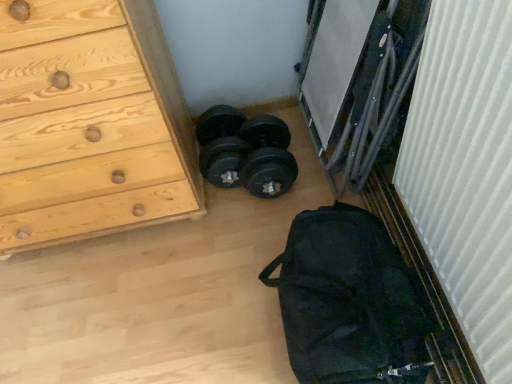
Measure the distance between natural wood chest of drawers at left and camera.

The distance of natural wood chest of drawers at left from camera is 33.01 inches.

The width and height of the screenshot is (512, 384). Identify the location of natural wood chest of drawers at left. (90, 124).

Image resolution: width=512 pixels, height=384 pixels. Identify the location of black fabric bag at lower right. (349, 301).

Measure the distance from black fabric bag at lower right to natural wood chest of drawers at left.

A distance of 25.01 inches exists between black fabric bag at lower right and natural wood chest of drawers at left.

Is black fabric bag at lower right far from natural wood chest of drawers at left?

No, black fabric bag at lower right is in close proximity to natural wood chest of drawers at left.

From a real-world perspective, is black fabric bag at lower right physically located above or below natural wood chest of drawers at left?

black fabric bag at lower right is situated lower than natural wood chest of drawers at left in the real world.

Which of these two, black fabric bag at lower right or natural wood chest of drawers at left, stands shorter?

Standing shorter between the two is black fabric bag at lower right.

Measure the distance from black rubber dumbbells at center to white ribbed curtain at right.

A distance of 26.06 inches exists between black rubber dumbbells at center and white ribbed curtain at right.

How different are the orientations of black rubber dumbbells at center and white ribbed curtain at right in degrees?

87.4 degrees separate the facing orientations of black rubber dumbbells at center and white ribbed curtain at right.

Is black rubber dumbbells at center taller or shorter than white ribbed curtain at right?

Clearly, black rubber dumbbells at center is shorter compared to white ribbed curtain at right.

You are a GUI agent. You are given a task and a screenshot of the screen. Output one action in this format:
    pyautogui.click(x=<x>, y=<y>)
    Task: Click on the curtain that appears on the right of black rubber dumbbells at center
    The image size is (512, 384).
    Given the screenshot: What is the action you would take?
    pyautogui.click(x=465, y=170)

From the image's perspective, relative to white ribbed curtain at right, is black fabric bag at lower right above or below?

Based on their image positions, black fabric bag at lower right is located beneath white ribbed curtain at right.

Which object is closer to the camera taking this photo, black fabric bag at lower right or white ribbed curtain at right?

white ribbed curtain at right is closer to the camera.

Is black fabric bag at lower right aimed at white ribbed curtain at right?

No.

Based on the photo, from a real-world perspective, is black fabric bag at lower right physically located above or below white ribbed curtain at right?

black fabric bag at lower right is below white ribbed curtain at right.

Is black fabric bag at lower right inside natural wood chest of drawers at left?

No, black fabric bag at lower right is not inside natural wood chest of drawers at left.

Based on the photo, is natural wood chest of drawers at left to the left or to the right of black fabric bag at lower right in the image?

Clearly, natural wood chest of drawers at left is on the left of black fabric bag at lower right in the image.

From the image's perspective, is natural wood chest of drawers at left positioned above or below black fabric bag at lower right?

Clearly, from the image's perspective, natural wood chest of drawers at left is above black fabric bag at lower right.

Is white ribbed curtain at right positioned with its back to black rubber dumbbells at center?

No, white ribbed curtain at right is not facing the opposite direction of black rubber dumbbells at center.

Is point (426, 243) farther from camera compared to point (199, 123)?

That is False.

Does white ribbed curtain at right appear on the right side of black rubber dumbbells at center?

Indeed, white ribbed curtain at right is positioned on the right side of black rubber dumbbells at center.

Which is in front, white ribbed curtain at right or black rubber dumbbells at center?

white ribbed curtain at right is in front.

Does white ribbed curtain at right have a greater height compared to black fabric bag at lower right?

Yes.

Is white ribbed curtain at right placed right next to black fabric bag at lower right?

No, white ribbed curtain at right is not touching black fabric bag at lower right.

From a real-world perspective, which is physically below, natural wood chest of drawers at left or white ribbed curtain at right?

In real-world perspective, natural wood chest of drawers at left is lower.

From the image's perspective, is natural wood chest of drawers at left over white ribbed curtain at right?

Correct, natural wood chest of drawers at left appears higher than white ribbed curtain at right in the image.

Is natural wood chest of drawers at left far from white ribbed curtain at right?

No, there isn't a large distance between natural wood chest of drawers at left and white ribbed curtain at right.

What's the angular difference between natural wood chest of drawers at left and white ribbed curtain at right's facing directions?

They differ by 90 degrees in their facing directions.

I want to click on chest of drawers located on the left of black fabric bag at lower right, so 90,124.

I want to click on reel that appears above the white ribbed curtain at right (from the image's perspective), so click(246, 151).

Which object lies further to the anchor point white ribbed curtain at right, black fabric bag at lower right or natural wood chest of drawers at left?

The object further to white ribbed curtain at right is natural wood chest of drawers at left.

Considering their positions, is natural wood chest of drawers at left positioned closer to black rubber dumbbells at center than white ribbed curtain at right?

Among the two, natural wood chest of drawers at left is located nearer to black rubber dumbbells at center.

When comparing their distances from black rubber dumbbells at center, does natural wood chest of drawers at left or black fabric bag at lower right seem further?

black fabric bag at lower right is further to black rubber dumbbells at center.

Considering their positions, is black fabric bag at lower right positioned closer to white ribbed curtain at right than black rubber dumbbells at center?

black fabric bag at lower right.

Looking at the image, which one is located further to black fabric bag at lower right, black rubber dumbbells at center or natural wood chest of drawers at left?

natural wood chest of drawers at left.

Looking at the image, which one is located further to white ribbed curtain at right, natural wood chest of drawers at left or black rubber dumbbells at center?

natural wood chest of drawers at left is positioned further to the anchor white ribbed curtain at right.

From the image, which object appears to be nearer to black fabric bag at lower right, white ribbed curtain at right or natural wood chest of drawers at left?

The object closer to black fabric bag at lower right is white ribbed curtain at right.

Based on their spatial positions, is black rubber dumbbells at center or white ribbed curtain at right further from black fabric bag at lower right?

black rubber dumbbells at center lies further to black fabric bag at lower right than the other object.

Identify the location of bag situated between natural wood chest of drawers at left and white ribbed curtain at right from left to right. (349, 301).

The width and height of the screenshot is (512, 384). Identify the location of reel located between natural wood chest of drawers at left and black fabric bag at lower right in the left-right direction. (246, 151).

What are the coordinates of `reel between natural wood chest of drawers at left and white ribbed curtain at right in the horizontal direction` in the screenshot? It's located at (246, 151).

Locate an element on the screen. bag between white ribbed curtain at right and black rubber dumbbells at center in the front-back direction is located at coordinates (349, 301).